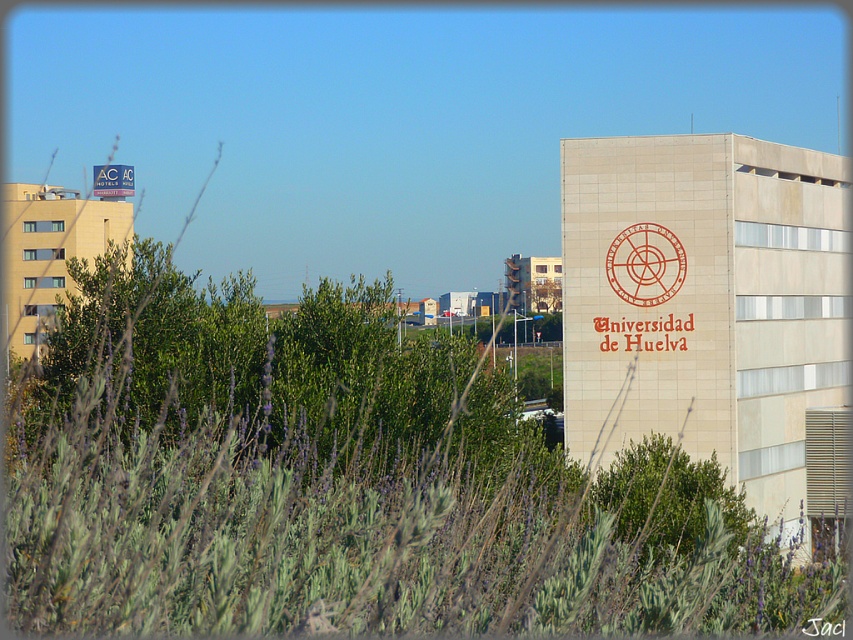
Which of these two, green leafy tree at center or red rubber stamp at upper center, stands shorter?

red rubber stamp at upper center is shorter.

Is green leafy tree at center smaller than red rubber stamp at upper center?

No.

What do you see at coordinates (666, 497) in the screenshot? The image size is (853, 640). I see `green leafy tree at center` at bounding box center [666, 497].

Where is `green leafy tree at center`? green leafy tree at center is located at coordinates (666, 497).

Does green leafy tree at center appear on the left side of matte red sign at upper left?

In fact, green leafy tree at center is to the right of matte red sign at upper left.

Does point (653, 499) come behind point (119, 195)?

No, it is not.

Which is in front, point (662, 445) or point (120, 189)?

Point (662, 445) is in front.

Locate an element on the screen. Image resolution: width=853 pixels, height=640 pixels. green leafy tree at center is located at coordinates (666, 497).

Does red rubber stamp at upper center appear over matte red sign at upper left?

No, red rubber stamp at upper center is not above matte red sign at upper left.

Describe the element at coordinates (645, 264) in the screenshot. I see `red rubber stamp at upper center` at that location.

Who is more distant from viewer, [641,298] or [103,170]?

Positioned behind is point [103,170].

You are a GUI agent. You are given a task and a screenshot of the screen. Output one action in this format:
    pyautogui.click(x=<x>, y=<y>)
    Task: Click on the red rubber stamp at upper center
    The image size is (853, 640).
    Given the screenshot: What is the action you would take?
    [x=645, y=264]